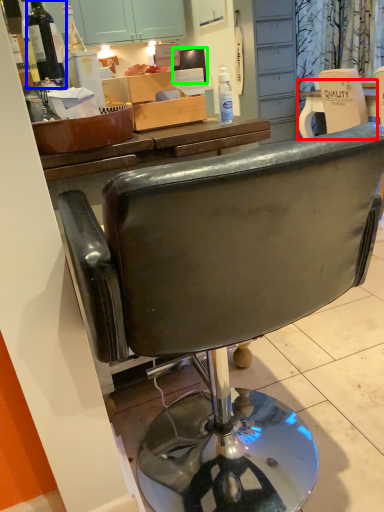
Question: Estimate the real-world distances between objects in this image. Which object is closer to desk (highlighted by a red box), bottle (highlighted by a blue box) or television (highlighted by a green box)?

Choices:
 (A) bottle
 (B) television

Answer: (B)